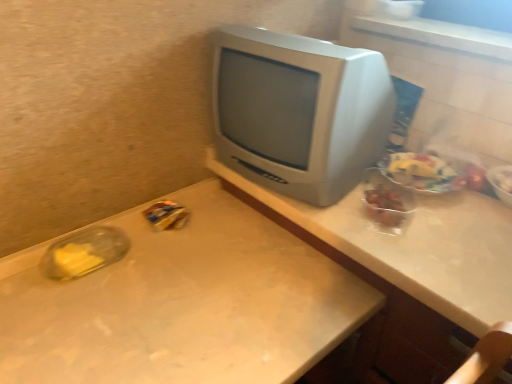
Identify the location of vacant space that is to the left of translucent plastic bowl at upper right, the fourth food in the left-to-right sequence. (459, 203).